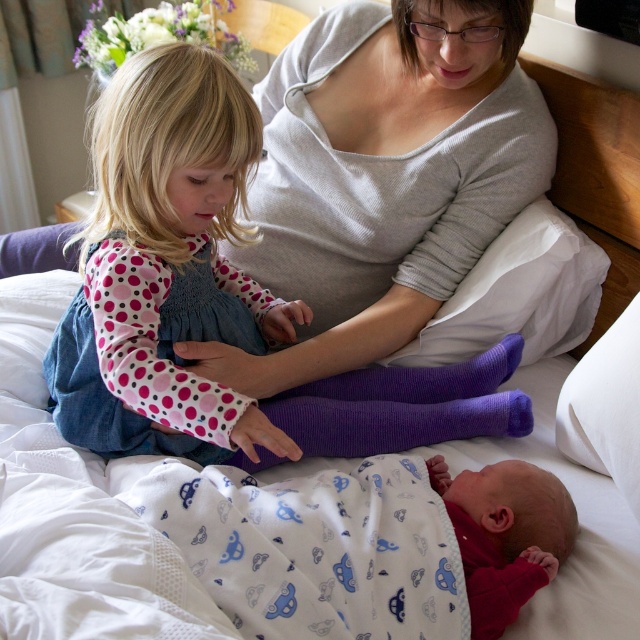
You are a photographer setting up a shoot in this bedroom scene. You need to place a small prop between the denim dress at upper left and the white cotton swaddle at lower center. Based on their positions, where should you place the prop to ensure it is between them?

The denim dress at upper left is above the white cotton swaddle at lower center, so placing the prop midway between them would position it between the denim dress at upper left and the white cotton swaddle at lower center.

You are a photographer trying to capture a closeup of both the white cotton swaddle at lower center and the purple knitted sock at center in the scene. Given their sizes, which object will require you to zoom in more to fill the frame?

The purple knitted sock at center will require more zooming in because it is smaller in width compared to the white cotton swaddle at lower center.